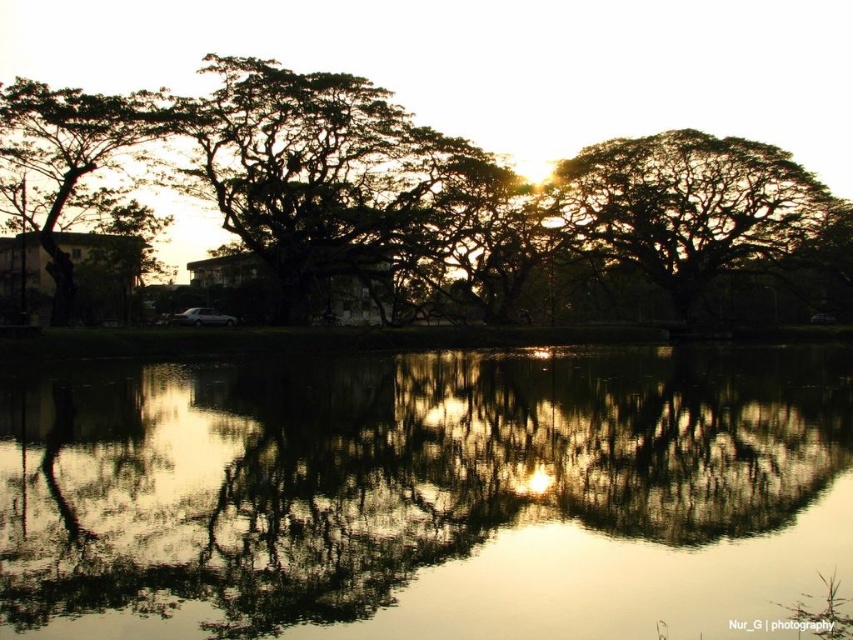
You are an artist trying to paint the scene. You want to ensure the trees are placed correctly in terms of depth. Given that you have both the silhouette leafy tree at center and the dark green leafy tree at upper right in your view, which tree should you paint in front to maintain the scene depth?

The silhouette leafy tree at center should be painted in front because it is closer to the viewer than the dark green leafy tree at upper right.

You are standing at the point with coordinates point (x=80, y=172) and want to walk towards the point with coordinates point (x=695, y=234). According to the scene, will the path be obstructed by any trees or objects?

The point (x=695, y=234) is behind point (x=80, y=172), so when you are at point (x=80, y=172) and walk towards point (x=695, y=234), the path might be obstructed by the large trees in the background since they are between you and the destination point.